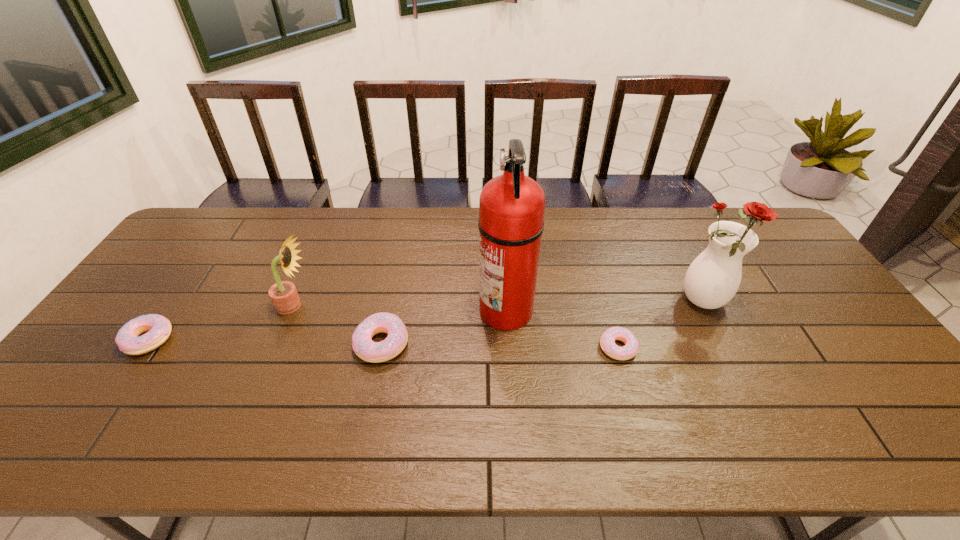
Please point a spot to add another doughnut on the right. Please provide its 2D coordinates. Your answer should be formatted as a tuple, i.e. [(x, y)], where the tuple contains the x and y coordinates of a point satisfying the conditions above.

[(858, 352)]